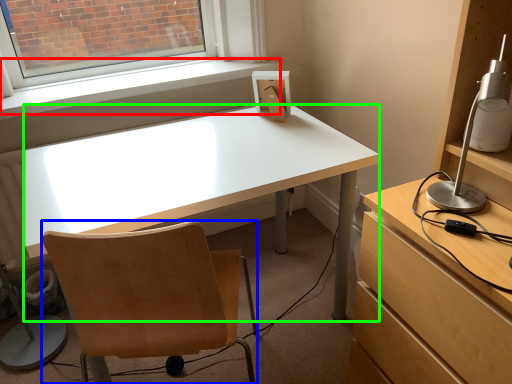
Question: Considering the real-world distances, which object is farthest from window sill (highlighted by a red box)? chair (highlighted by a blue box) or desk (highlighted by a green box)?

Choices:
 (A) chair
 (B) desk

Answer: (A)